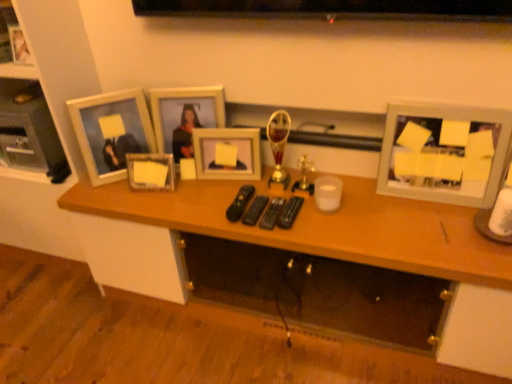
Where is `unoccupied space behind black plastic remote control at center, which is the third remote control from left to right`? The height and width of the screenshot is (384, 512). unoccupied space behind black plastic remote control at center, which is the third remote control from left to right is located at coordinates (265, 185).